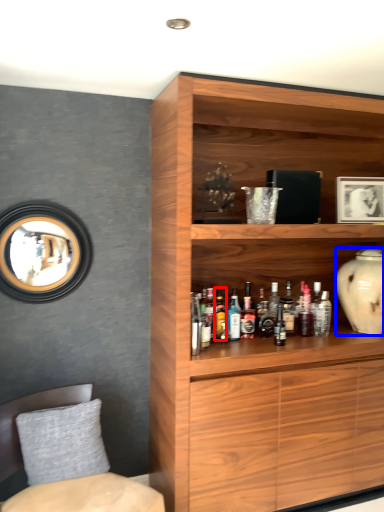
Question: Which object is closer to the camera taking this photo, bottle (highlighted by a red box) or vase (highlighted by a blue box)?

Choices:
 (A) bottle
 (B) vase

Answer: (A)